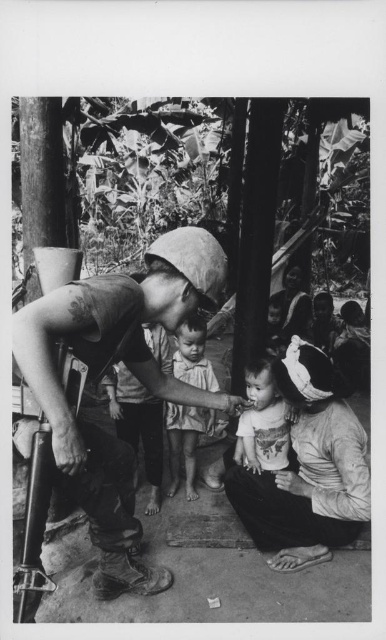
Can you confirm if matte black helmet at center is thinner than smooth skin child at center?

Incorrect, matte black helmet at center's width is not less than smooth skin child at center's.

You are a GUI agent. You are given a task and a screenshot of the screen. Output one action in this format:
    pyautogui.click(x=<x>, y=<y>)
    Task: Click on the matte black helmet at center
    
    Given the screenshot: What is the action you would take?
    pyautogui.click(x=104, y=372)

What do you see at coordinates (104, 372) in the screenshot?
I see `matte black helmet at center` at bounding box center [104, 372].

In order to click on matte black helmet at center in this screenshot , I will do `click(104, 372)`.

Between point (91, 340) and point (336, 490), which one is positioned behind?

The point (336, 490) is more distant.

Between matte black helmet at center and matte white shirt at lower right, which one appears on the right side from the viewer's perspective?

From the viewer's perspective, matte white shirt at lower right appears more on the right side.

Measure the distance between matte black helmet at center and camera.

A distance of 6.12 feet exists between matte black helmet at center and camera.

The image size is (386, 640). Identify the location of matte black helmet at center. (104, 372).

Can you confirm if matte black helmet at center is positioned to the left of printed cotton shirt at center?

Yes, matte black helmet at center is to the left of printed cotton shirt at center.

I want to click on matte black helmet at center, so click(104, 372).